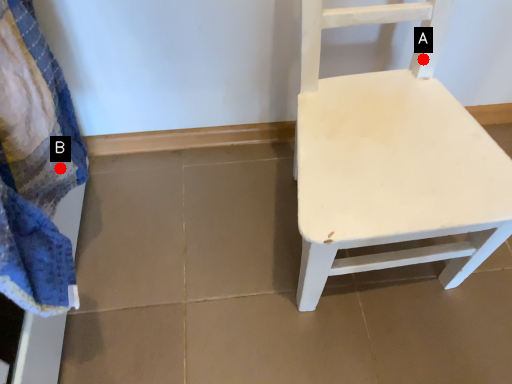
Question: Two points are circled on the image, labeled by A and B beside each circle. Which point is closer to the camera?

Choices:
 (A) A is closer
 (B) B is closer

Answer: (B)